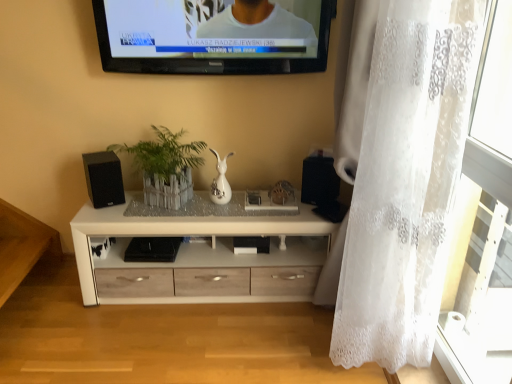
Question: Can you confirm if black matte speaker at left, the first speaker positioned from the left, is wider than green leafy plant at center?

Choices:
 (A) yes
 (B) no

Answer: (B)

Question: From the image's perspective, is black matte speaker at left, the first speaker positioned from the left, under green leafy plant at center?

Choices:
 (A) no
 (B) yes

Answer: (B)

Question: Does black matte speaker at left, which is the 2th speaker in right-to-left order, have a larger size compared to green leafy plant at center?

Choices:
 (A) no
 (B) yes

Answer: (A)

Question: Is black matte speaker at left, which is the 2th speaker in right-to-left order, taller than green leafy plant at center?

Choices:
 (A) yes
 (B) no

Answer: (B)

Question: Is the depth of black matte speaker at left, which is the 2th speaker in right-to-left order, greater than that of green leafy plant at center?

Choices:
 (A) no
 (B) yes

Answer: (B)

Question: Is black matte speaker at left, the first speaker positioned from the left, thinner than green leafy plant at center?

Choices:
 (A) no
 (B) yes

Answer: (B)

Question: Is there a large distance between black glossy television at upper center and white wood chest of drawers at center?

Choices:
 (A) no
 (B) yes

Answer: (A)

Question: From the image's perspective, is black glossy television at upper center beneath white wood chest of drawers at center?

Choices:
 (A) no
 (B) yes

Answer: (A)

Question: Does black glossy television at upper center lie in front of white wood chest of drawers at center?

Choices:
 (A) no
 (B) yes

Answer: (B)

Question: From the image's perspective, does black glossy television at upper center appear higher than white wood chest of drawers at center?

Choices:
 (A) yes
 (B) no

Answer: (A)

Question: Does black glossy television at upper center have a larger size compared to white wood chest of drawers at center?

Choices:
 (A) no
 (B) yes

Answer: (A)

Question: Can we say black glossy television at upper center lies outside white wood chest of drawers at center?

Choices:
 (A) yes
 (B) no

Answer: (A)

Question: Does black matte speaker at left, which is the 2th speaker in right-to-left order, lie behind white wood chest of drawers at center?

Choices:
 (A) no
 (B) yes

Answer: (B)